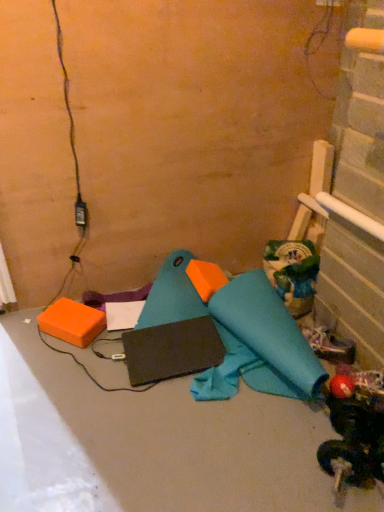
Question: Is matte black laptop at center wider or thinner than white fabric shoe at lower right?

Choices:
 (A) wide
 (B) thin

Answer: (A)

Question: Considering the positions of matte black laptop at center and white fabric shoe at lower right in the image, is matte black laptop at center taller or shorter than white fabric shoe at lower right?

Choices:
 (A) tall
 (B) short

Answer: (B)

Question: Which of these objects is positioned closest to the green matte bag at upper right, the 1th toy from the top?

Choices:
 (A) orange foam block at lower left
 (B) white fabric shoe at lower right
 (C) black matte laptop at center
 (D) rubberized red ball at lower right, which is the second toy from back to front
 (E) matte black laptop at center

Answer: (B)

Question: Estimate the real-world distances between objects in this image. Which object is closer to the green matte bag at upper right, which is counted as the second toy, starting from the front?

Choices:
 (A) matte black laptop at center
 (B) black matte laptop at center
 (C) rubberized red ball at lower right, which is the second toy from back to front
 (D) orange foam block at lower left
 (E) white fabric shoe at lower right

Answer: (E)